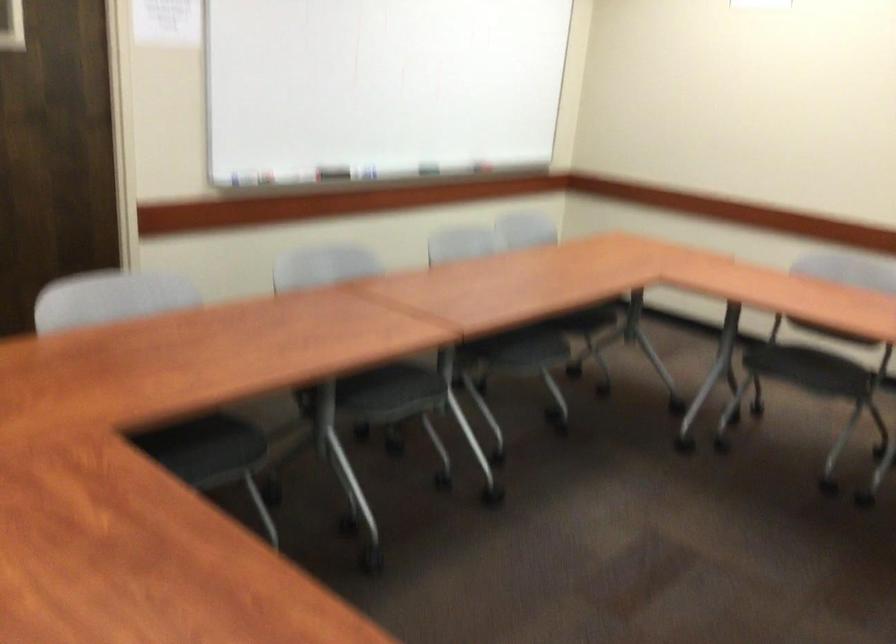
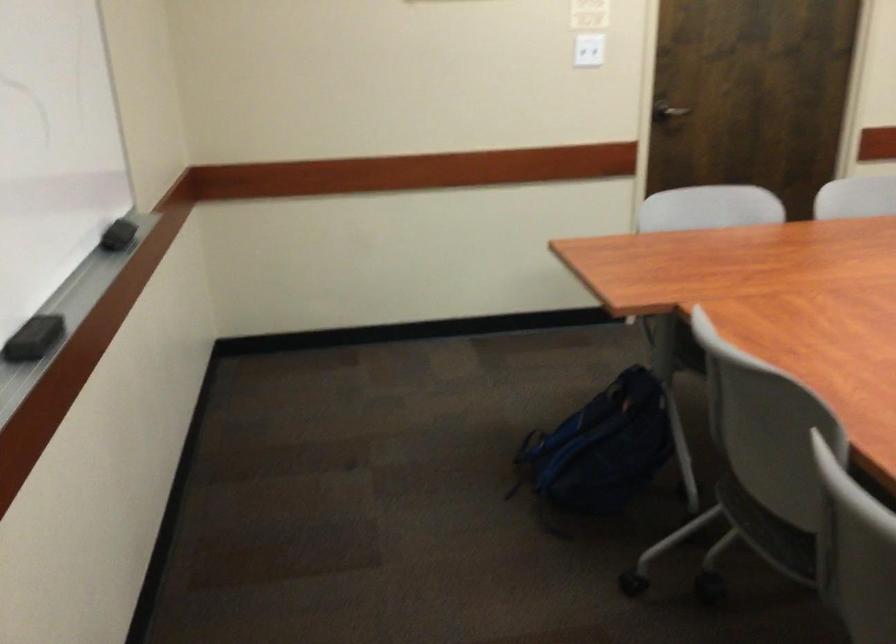
Question: The images are taken continuously from a first-person perspective. In which direction is your viewpoint rotating?

Choices:
 (A) Left
 (B) Right
 (C) Up
 (D) Down

Answer: (A)